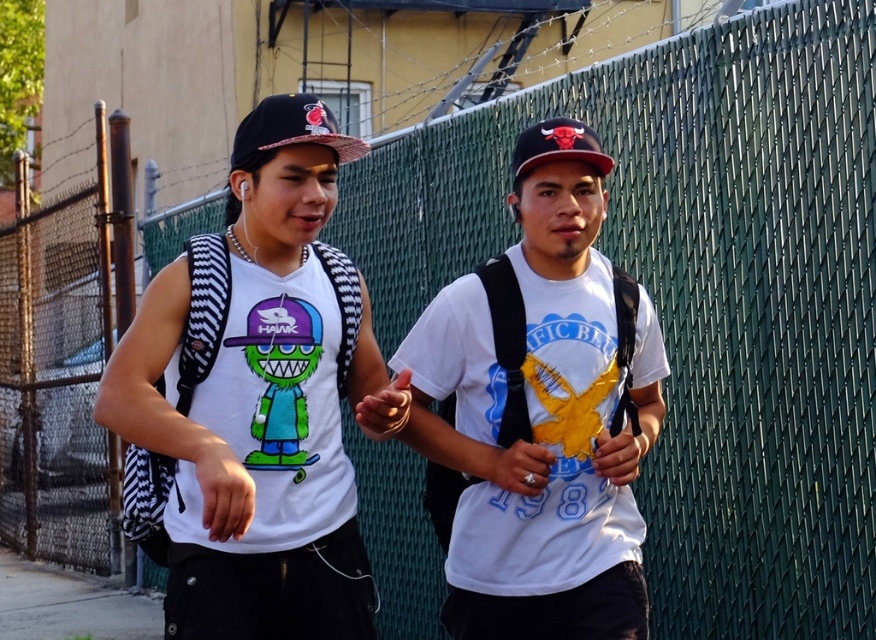
You are a pedestrian standing on the gray concrete pavement at lower left and want to pick up the red matte baseball cap at center. Is the cap closer to you or further away?

The gray concrete pavement at lower left is further to the viewer than red matte baseball cap at center, so the cap is closer to you.

You are taking a photo of two people walking side by side along a sidewalk next to a green chain link fence. The two people are at the coordinates point (203, 616) and point (514, 465). Which coordinate corresponds to the person who is closer to the camera?

The point (203, 616) is closer to the camera than point (514, 465).